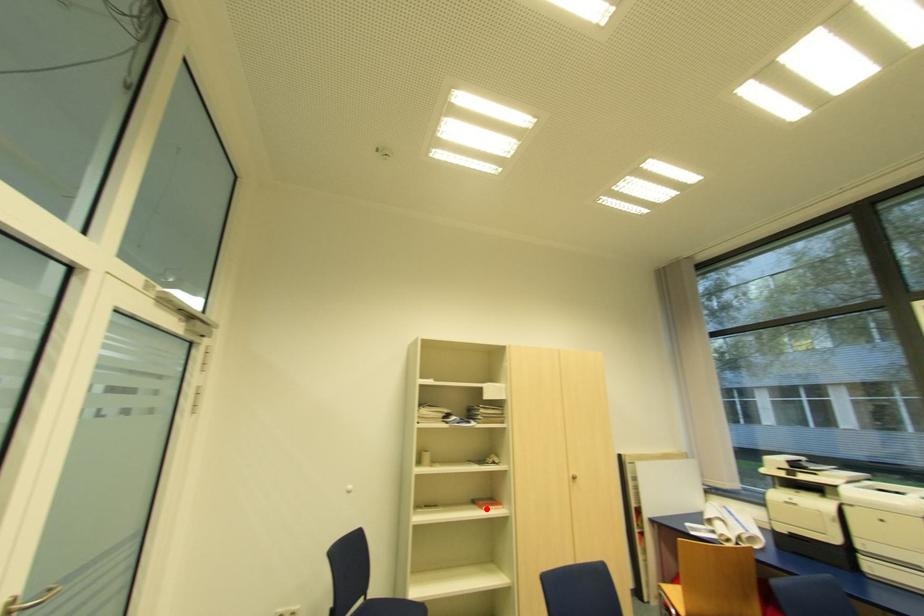
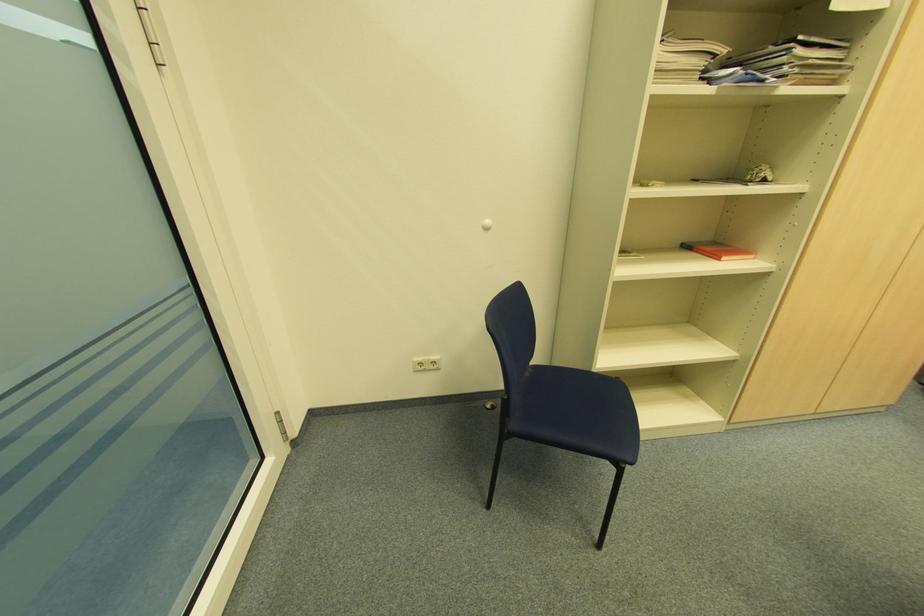
Where in the second image is the point corresponding to the highlighted location from the first image?

(726, 257)